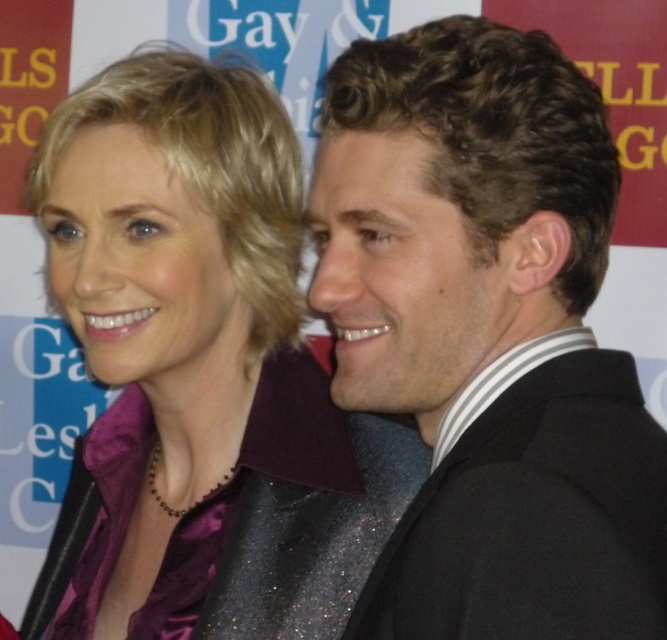
The width and height of the screenshot is (667, 640). What do you see at coordinates (488, 333) in the screenshot?
I see `shiny black suit at right` at bounding box center [488, 333].

Is shiny black suit at right positioned behind purple satin blouse at center?

No, shiny black suit at right is closer to the viewer.

Find the location of a particular element. The width and height of the screenshot is (667, 640). shiny black suit at right is located at coordinates click(488, 333).